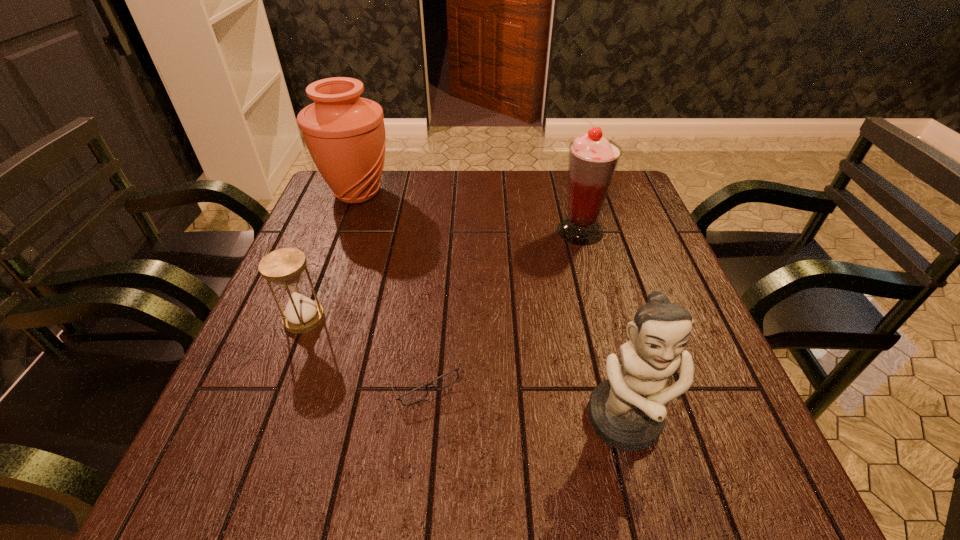
Locate an element on the screen. This screenshot has height=540, width=960. vacant space at the left edge is located at coordinates (318, 267).

Find the location of a particular element. free region at the near left corner is located at coordinates (212, 498).

This screenshot has height=540, width=960. Identify the location of free space between the shortest object and the hourglass. (364, 349).

What are the coordinates of `vacant area that lies between the third farthest object and the fourth nearest object` in the screenshot? It's located at (442, 275).

The width and height of the screenshot is (960, 540). I want to click on free space between the fourth nearest object and the third object from left to right, so click(502, 306).

This screenshot has height=540, width=960. I want to click on free space between the figurine and the third object from right to left, so click(x=524, y=401).

Where is `free space between the hourglass and the second farthest object`? free space between the hourglass and the second farthest object is located at coordinates (442, 275).

The height and width of the screenshot is (540, 960). In order to click on free spot between the figurine and the spectacles in this screenshot , I will do `click(524, 401)`.

Image resolution: width=960 pixels, height=540 pixels. Identify the location of free area in between the third object from left to right and the fourth tallest object. (364, 349).

Image resolution: width=960 pixels, height=540 pixels. I want to click on vacant space that's between the smoothie and the farthest object, so click(468, 212).